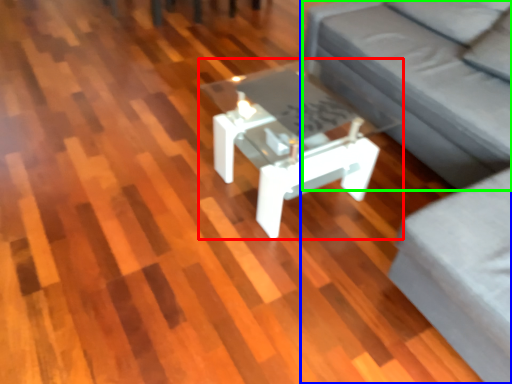
Question: Which object is positioned farthest from coffee table (highlighted by a red box)? Select from studio couch (highlighted by a blue box) and couch (highlighted by a green box).

Choices:
 (A) studio couch
 (B) couch

Answer: (A)